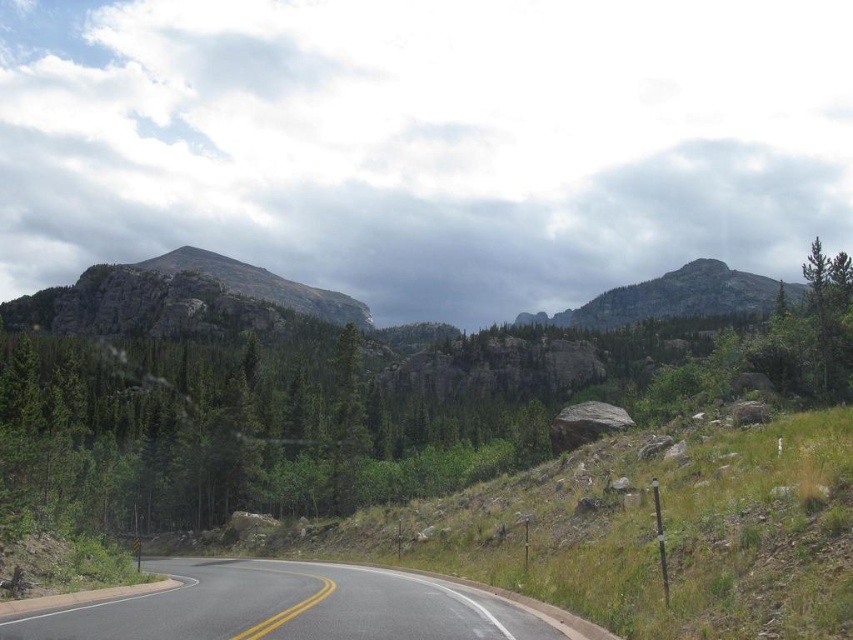
You are a hiker planning to take a photo of the green matte tree at center and the rugged granite mountain at upper right. Which object should you focus on first if you want to capture both in a single frame without moving the camera?

You should focus on the green matte tree at center first because it is closer to the camera than the rugged granite mountain at upper right, allowing both to be in the frame simultaneously.